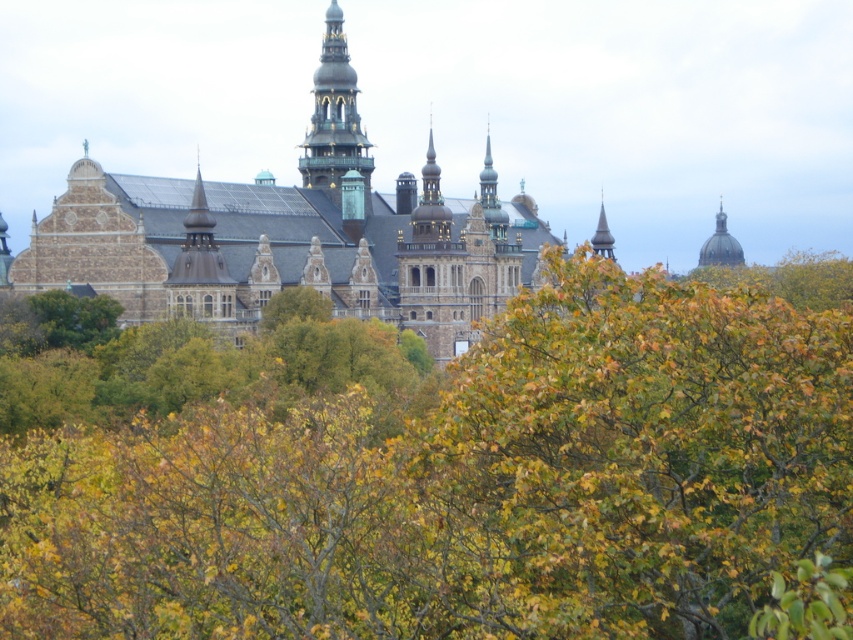
Question: Which point is farther to the camera?

Choices:
 (A) green copper tower at upper center
 (B) brown stone castle at center
 (C) green leafy tree at center
 (D) smooth gold dome at upper right

Answer: (D)

Question: From the image, what is the correct spatial relationship of green copper tower at upper center in relation to smooth gold dome at upper right?

Choices:
 (A) right
 (B) left

Answer: (B)

Question: Is brown stone castle at center to the right of smooth gold dome at upper right from the viewer's perspective?

Choices:
 (A) yes
 (B) no

Answer: (B)

Question: Does green leafy tree at center have a smaller size compared to green copper tower at upper center?

Choices:
 (A) yes
 (B) no

Answer: (B)

Question: Estimate the real-world distances between objects in this image. Which object is closer to the brown stone castle at center?

Choices:
 (A) green copper tower at upper center
 (B) green leafy tree at center
 (C) smooth gold dome at upper right

Answer: (A)

Question: Among these points, which one is nearest to the camera?

Choices:
 (A) (717, 214)
 (B) (16, 554)
 (C) (372, 310)
 (D) (366, 141)

Answer: (B)